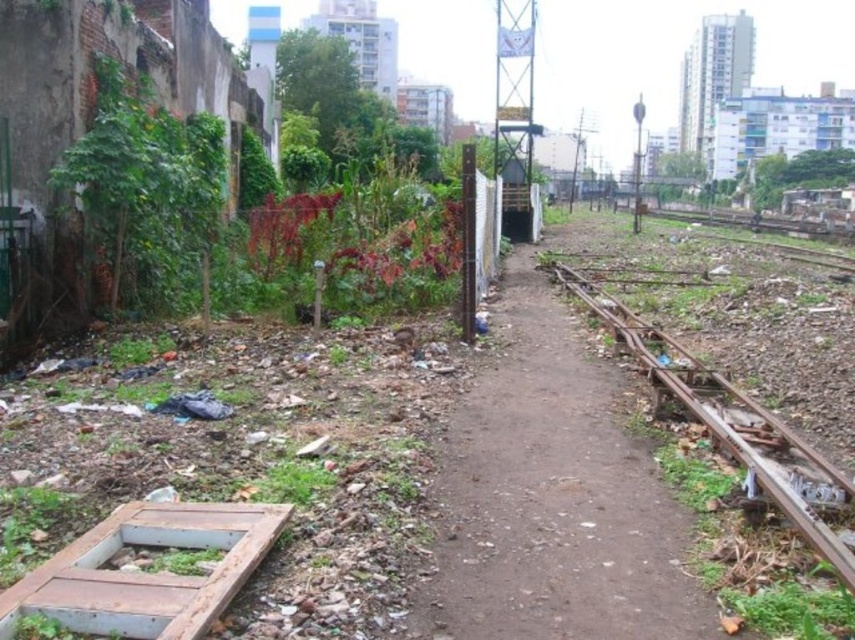
Which is below, dirt path at center or rusty metal train track at right?

Positioned lower is dirt path at center.

Is dirt path at center positioned at the back of rusty metal train track at right?

Yes, it is.

Does point (611, 500) come in front of point (806, 540)?

No, (611, 500) is further to viewer.

Image resolution: width=855 pixels, height=640 pixels. What are the coordinates of `dirt path at center` in the screenshot? It's located at (551, 497).